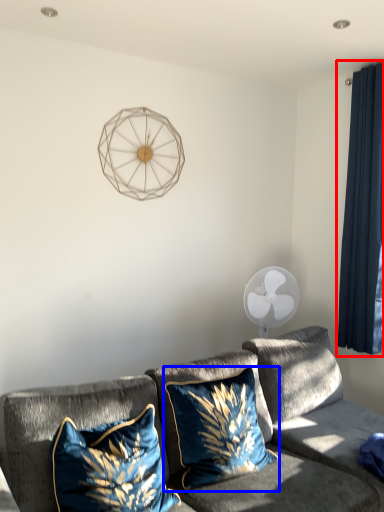
Question: Which object appears farthest to the camera in this image, curtain (highlighted by a red box) or pillow (highlighted by a blue box)?

Choices:
 (A) curtain
 (B) pillow

Answer: (A)